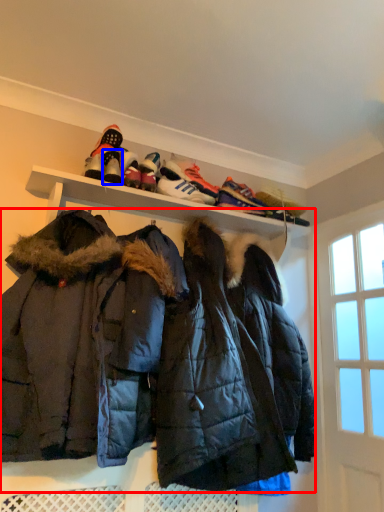
Question: Which object is further to the camera taking this photo, jacket (highlighted by a red box) or footwear (highlighted by a blue box)?

Choices:
 (A) jacket
 (B) footwear

Answer: (B)